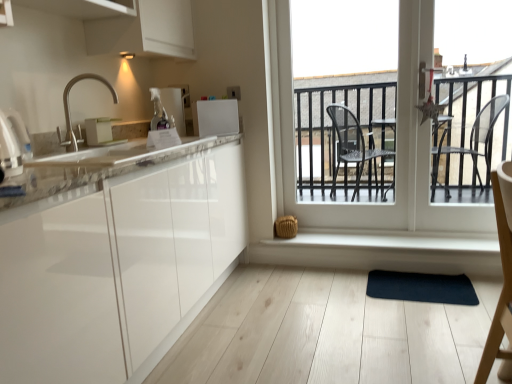
Question: Can you confirm if white glossy electric kettle at left, the 1th appliance when ordered from left to right, is shorter than satin nickel faucet at upper left?

Choices:
 (A) no
 (B) yes

Answer: (B)

Question: Considering the relative positions of white glossy electric kettle at left, acting as the first appliance starting from the front, and satin nickel faucet at upper left in the image provided, is white glossy electric kettle at left, acting as the first appliance starting from the front, to the right of satin nickel faucet at upper left from the viewer's perspective?

Choices:
 (A) no
 (B) yes

Answer: (A)

Question: Is white glossy electric kettle at left, acting as the first appliance starting from the front, thinner than satin nickel faucet at upper left?

Choices:
 (A) yes
 (B) no

Answer: (A)

Question: Is white glossy electric kettle at left, acting as the fourth appliance starting from the back, facing away from satin nickel faucet at upper left?

Choices:
 (A) yes
 (B) no

Answer: (B)

Question: From a real-world perspective, is white glossy electric kettle at left, acting as the first appliance starting from the front, positioned over satin nickel faucet at upper left based on gravity?

Choices:
 (A) no
 (B) yes

Answer: (A)

Question: From the image's perspective, is white glossy electric kettle at left, acting as the first appliance starting from the front, located above satin nickel faucet at upper left?

Choices:
 (A) no
 (B) yes

Answer: (A)

Question: Does white glossy microwave at upper center, the 2th appliance positioned from the back, have a larger size compared to white glossy electric kettle at left, acting as the first appliance starting from the front?

Choices:
 (A) no
 (B) yes

Answer: (A)

Question: From the image's perspective, is white glossy microwave at upper center, acting as the third appliance starting from the front, above white glossy electric kettle at left, the 1th appliance when ordered from left to right?

Choices:
 (A) yes
 (B) no

Answer: (A)

Question: Does white glossy microwave at upper center, acting as the third appliance starting from the front, touch white glossy electric kettle at left, acting as the fourth appliance starting from the back?

Choices:
 (A) no
 (B) yes

Answer: (A)

Question: Is the depth of white glossy microwave at upper center, which is the fourth appliance from left to right, greater than that of white glossy electric kettle at left, which is the 4th appliance in right-to-left order?

Choices:
 (A) no
 (B) yes

Answer: (B)

Question: Is white glossy microwave at upper center, acting as the third appliance starting from the front, shorter than white glossy electric kettle at left, the 1th appliance when ordered from left to right?

Choices:
 (A) no
 (B) yes

Answer: (A)

Question: From a real-world perspective, is white glossy microwave at upper center, which is the fourth appliance from left to right, below white glossy electric kettle at left, acting as the fourth appliance starting from the back?

Choices:
 (A) yes
 (B) no

Answer: (B)

Question: Is white glossy countertop at left at the back of transparent glass door at center?

Choices:
 (A) no
 (B) yes

Answer: (A)